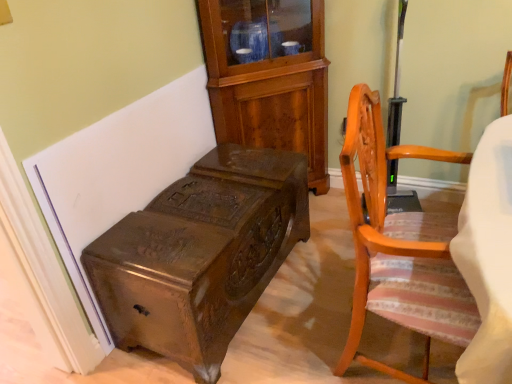
Question: Is light brown wood chair at right thinner than polished dark wood trunk at lower left?

Choices:
 (A) no
 (B) yes

Answer: (A)

Question: Considering the relative sizes of light brown wood chair at right and polished dark wood trunk at lower left in the image provided, is light brown wood chair at right smaller than polished dark wood trunk at lower left?

Choices:
 (A) yes
 (B) no

Answer: (B)

Question: Is light brown wood chair at right positioned before polished dark wood trunk at lower left?

Choices:
 (A) yes
 (B) no

Answer: (A)

Question: Is light brown wood chair at right looking in the opposite direction of polished dark wood trunk at lower left?

Choices:
 (A) yes
 (B) no

Answer: (A)

Question: From the image's perspective, is light brown wood chair at right under polished dark wood trunk at lower left?

Choices:
 (A) no
 (B) yes

Answer: (A)

Question: From the image's perspective, is polished dark wood trunk at lower left positioned above or below mahogany cabinet at upper center?

Choices:
 (A) below
 (B) above

Answer: (A)

Question: From a real-world perspective, is polished dark wood trunk at lower left positioned above or below mahogany cabinet at upper center?

Choices:
 (A) below
 (B) above

Answer: (A)

Question: In the image, is polished dark wood trunk at lower left positioned in front of or behind mahogany cabinet at upper center?

Choices:
 (A) front
 (B) behind

Answer: (A)

Question: Visually, is polished dark wood trunk at lower left positioned to the left or to the right of mahogany cabinet at upper center?

Choices:
 (A) right
 (B) left

Answer: (B)

Question: Is polished dark wood trunk at lower left taller or shorter than light brown wood chair at right?

Choices:
 (A) short
 (B) tall

Answer: (A)

Question: From a real-world perspective, is polished dark wood trunk at lower left above or below light brown wood chair at right?

Choices:
 (A) above
 (B) below

Answer: (B)

Question: From the image's perspective, relative to light brown wood chair at right, is polished dark wood trunk at lower left above or below?

Choices:
 (A) below
 (B) above

Answer: (A)

Question: Choose the correct answer: Is polished dark wood trunk at lower left inside light brown wood chair at right or outside it?

Choices:
 (A) inside
 (B) outside

Answer: (B)

Question: Considering their positions, is mahogany cabinet at upper center located in front of or behind polished dark wood trunk at lower left?

Choices:
 (A) behind
 (B) front

Answer: (A)

Question: Considering the positions of point (296, 122) and point (117, 235), is point (296, 122) closer or farther from the camera than point (117, 235)?

Choices:
 (A) farther
 (B) closer

Answer: (A)